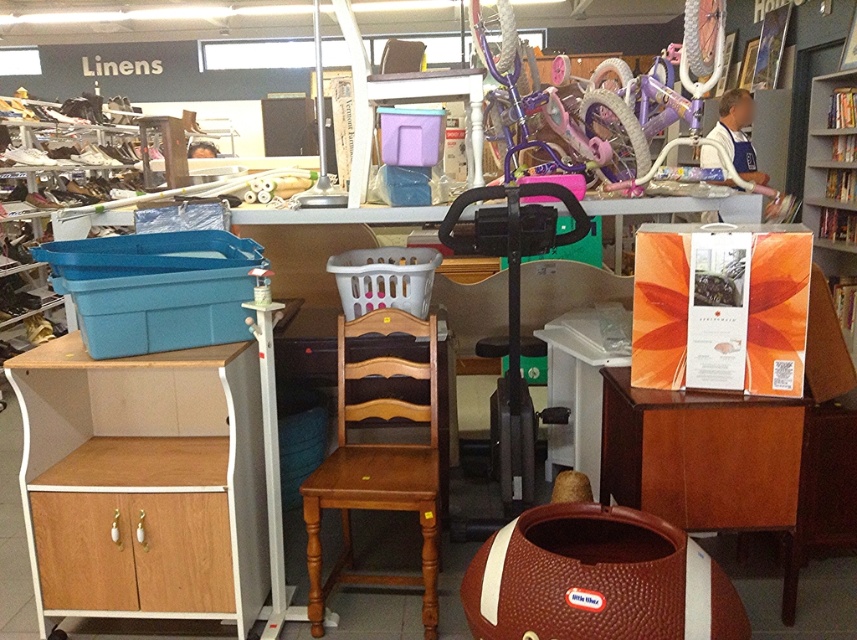
Question: Which object is closer to the camera taking this photo?

Choices:
 (A) brown wood cabinet at lower right
 (B) orange paperboard at upper right
 (C) light brown wood chair at center
 (D) white glossy table at lower center

Answer: (A)

Question: Which point is farther to the camera?

Choices:
 (A) (763, 493)
 (B) (106, 516)

Answer: (A)

Question: Can you confirm if wooden cabinet at lower left is wider than orange paperboard at upper right?

Choices:
 (A) yes
 (B) no

Answer: (A)

Question: Can you confirm if orange paperboard at upper right is positioned to the right of white glossy table at lower center?

Choices:
 (A) no
 (B) yes

Answer: (B)

Question: Among these objects, which one is nearest to the camera?

Choices:
 (A) wooden cabinet at left
 (B) wooden cabinet at lower left
 (C) brown wood cabinet at lower right

Answer: (A)

Question: Is wooden cabinet at left above orange paperboard at upper right?

Choices:
 (A) yes
 (B) no

Answer: (B)